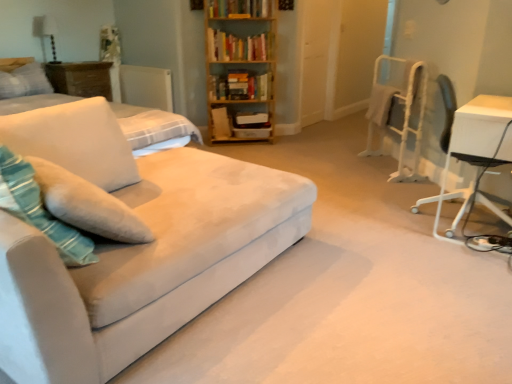
Question: Looking at the image, does white matte radiator at upper left seem bigger or smaller compared to suede couch at left?

Choices:
 (A) small
 (B) big

Answer: (A)

Question: From a real-world perspective, relative to suede couch at left, is white matte radiator at upper left vertically above or below?

Choices:
 (A) above
 (B) below

Answer: (A)

Question: Considering the real-world distances, which object is farthest from the white glossy table at right, arranged as the second table when viewed from the left?

Choices:
 (A) white matte radiator at upper left
 (B) hardcover books at center, which ranks as the 3th book in top-to-bottom order
 (C) teal velvety throw pillow at left
 (D) wooden bookcase at upper center
 (E) white soft pillow at upper left, positioned as the 1th pillow in back-to-front order

Answer: (E)

Question: Considering the real-world distances, which object is closest to the hardcover book at upper center, which appears as the first book when viewed from the top?

Choices:
 (A) white plastic chair at right
 (B) teal velvety throw pillow at left
 (C) hardcover books at center, which ranks as the 3th book in top-to-bottom order
 (D) suede couch at left
 (E) soft white fabric pillow at left, marked as the first pillow in a bottom-to-top arrangement

Answer: (C)